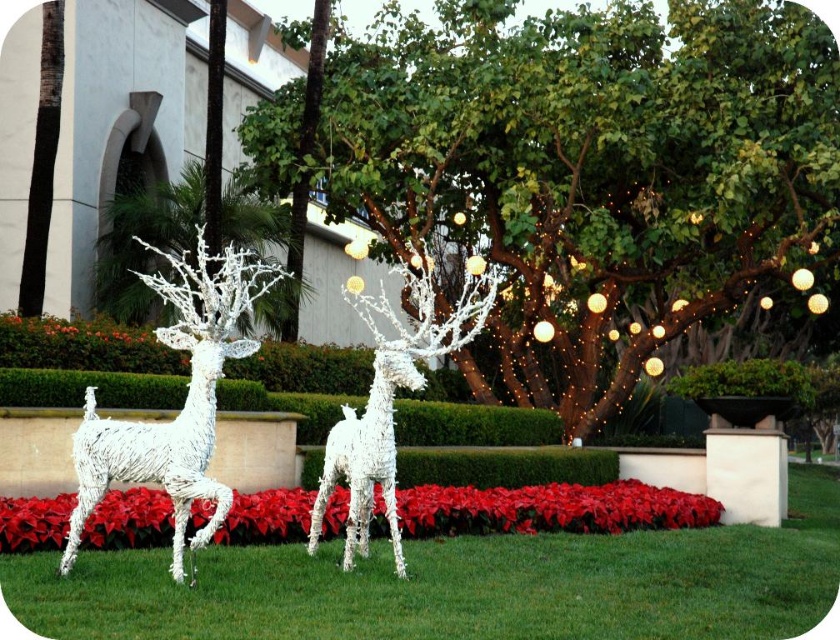
Question: Among these objects, which one is farthest from the camera?

Choices:
 (A) white wire tree at left
 (B) white wire sculpture at center
 (C) white wireframe deer at center

Answer: (A)

Question: Which point appears farthest from the camera in this image?

Choices:
 (A) (591, 552)
 (B) (219, 218)
 (C) (210, 403)

Answer: (B)

Question: In this image, where is green grass at center located relative to white wire sculpture at center?

Choices:
 (A) right
 (B) left

Answer: (A)

Question: Which point appears closest to the camera in this image?

Choices:
 (A) (92, 429)
 (B) (360, 312)
 (C) (140, 198)
 (D) (473, 172)

Answer: (A)

Question: Does green leafy tree at center appear over white wireframe deer at center?

Choices:
 (A) yes
 (B) no

Answer: (A)

Question: Is green leafy tree at center to the left of white wire sculpture at center from the viewer's perspective?

Choices:
 (A) no
 (B) yes

Answer: (A)